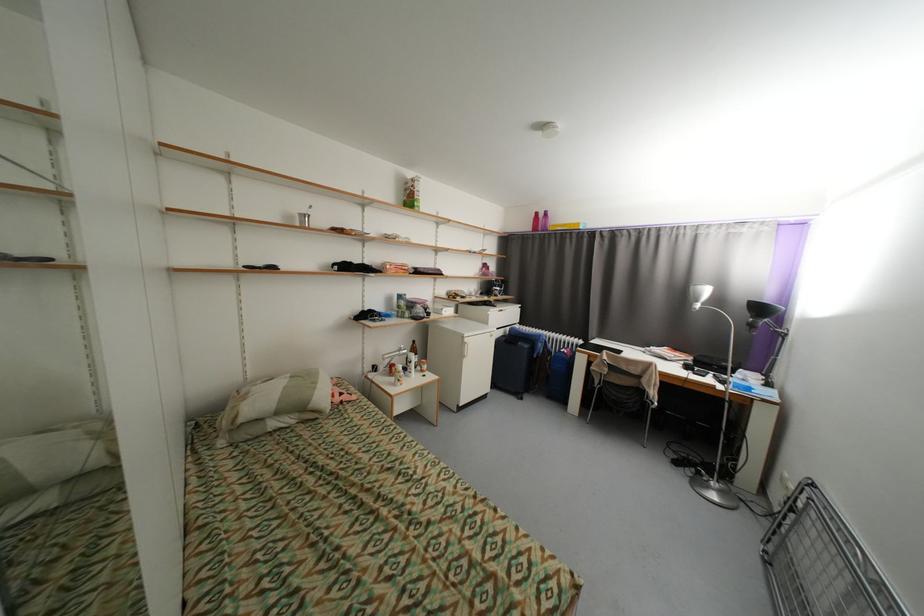
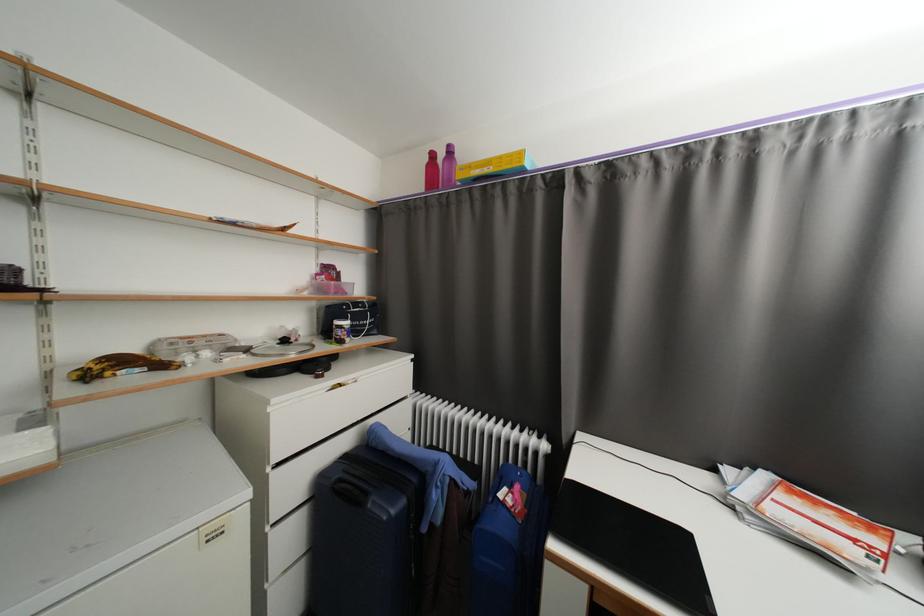
The point at (468, 298) is marked in the first image. Where is the corresponding point in the second image?

(167, 367)